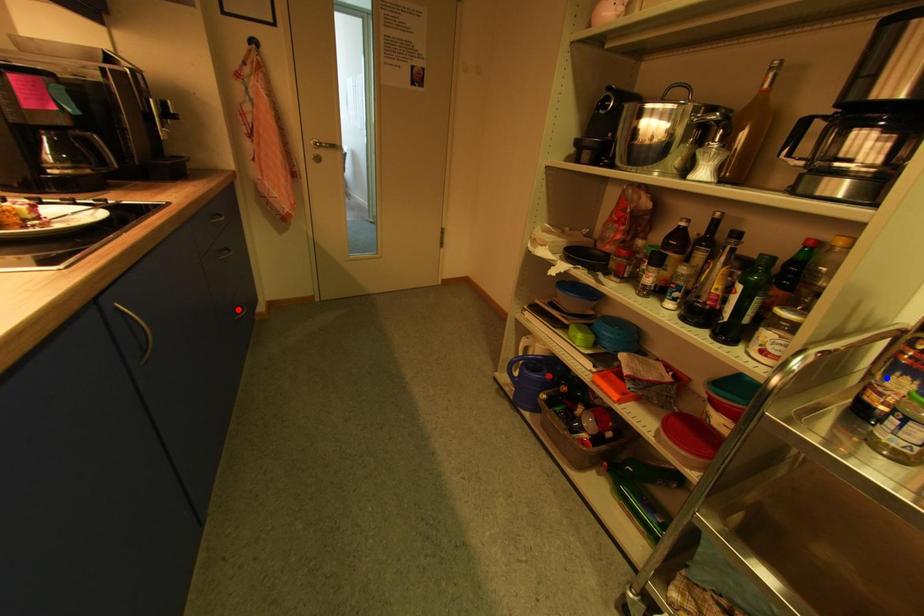
Question: Which of the two points in the image is closer to the camera?

Choices:
 (A) Blue point is closer.
 (B) Red point is closer.

Answer: (A)